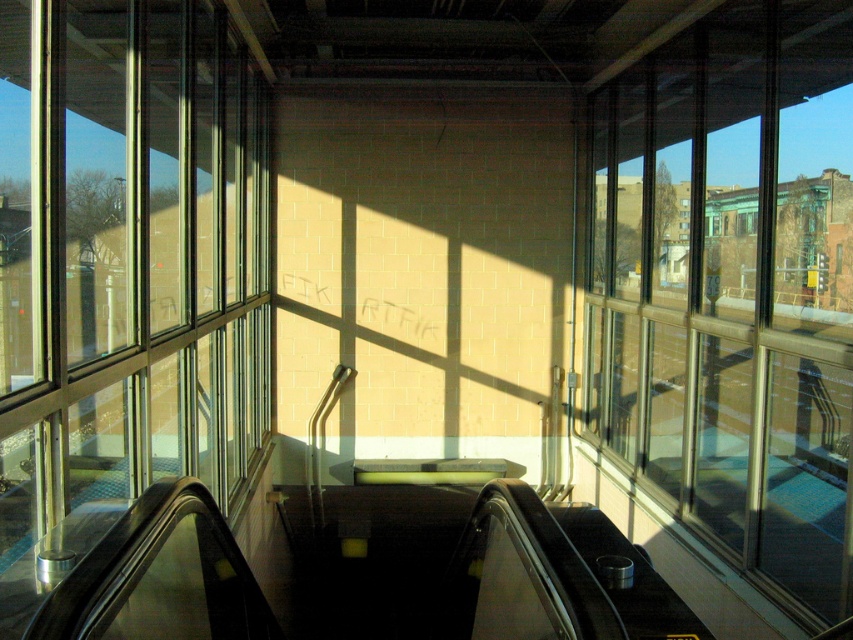
You are standing at the top of the escalator and want to check the time. You remember there is a clock on the transparent glass window at right. Where should you look relative to the escalator to find the clock?

The clock is on the transparent glass window at right, which is located at the position corresponding to the coordinates 0.461 on the x axis and 0.858 on the y axis relative to the image frame. Since you are at the top of the escalator looking downward, the window is on your right side, so you should look to your right towards the area near the lower right quadrant of your field of view to find the clock.

You are standing at the top of the escalator and want to know which side has a bigger window for taking a photo. Which side should you choose between the transparent glass window at right and the transparent glass windows at left?

The transparent glass window at right has a larger size compared to transparent glass windows at left, so you should choose the transparent glass window at right for taking a photo.